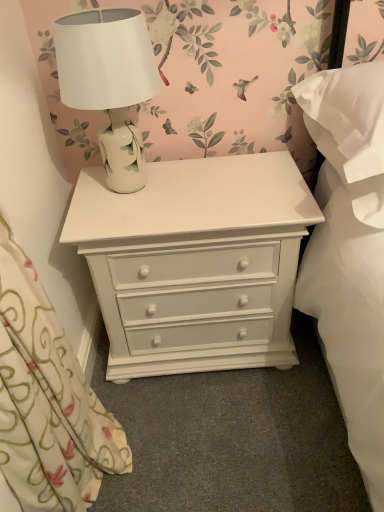
What are the coordinates of `vacant area that is in front of white ceramic lamp at upper center` in the screenshot? It's located at (136, 220).